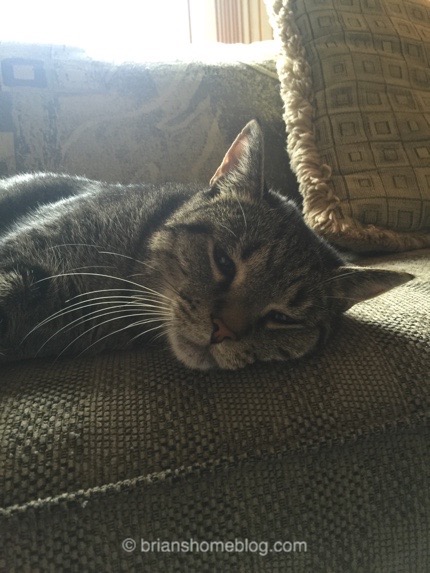
This screenshot has width=430, height=573. In order to click on sofa in this screenshot , I will do [x=86, y=426].